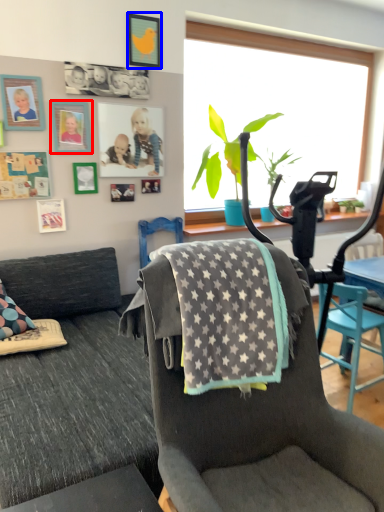
Question: Which object appears farthest to the camera in this image, picture frame (highlighted by a red box) or picture frame (highlighted by a blue box)?

Choices:
 (A) picture frame
 (B) picture frame

Answer: (B)